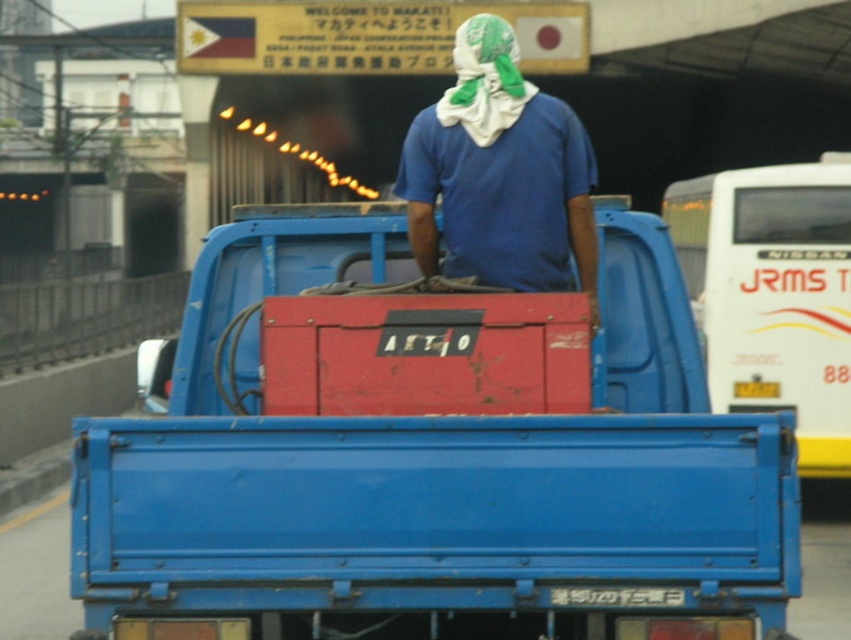
You are a delivery person who needs to place a new toolbox in the truck bed. The new toolbox is slightly smaller than the matte red toolbox at center. Where should you place the new toolbox so that it doesn not interfere with the blue cotton shirt at center?

The matte red toolbox at center is positioned under the blue cotton shirt at center. Since the new toolbox is smaller, placing it in the same area but slightly lower would prevent interference with the blue cotton shirt at center.

You are standing at the point marked as point (730, 212) and want to walk to the tunnel entrance. The tunnel entrance is 10 meters away from you. Can you reach the tunnel entrance without moving past the blue pickup truck?

The distance between point 0.333, 0.839 and the viewer is 15.01 meters. Since the tunnel entrance is only 10 meters away from you, you can reach it without moving past the blue pickup truck as the distance is shorter than the distance to the truck.